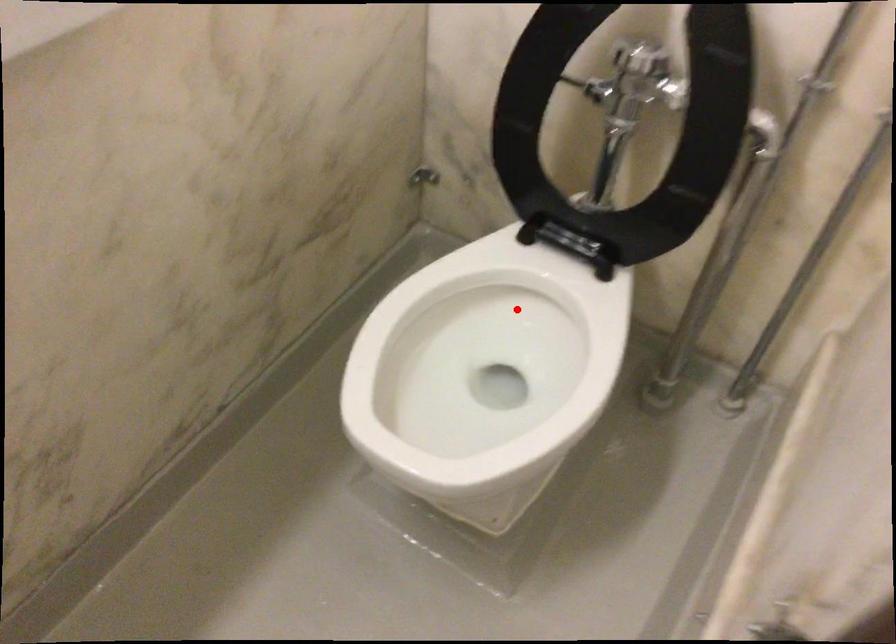
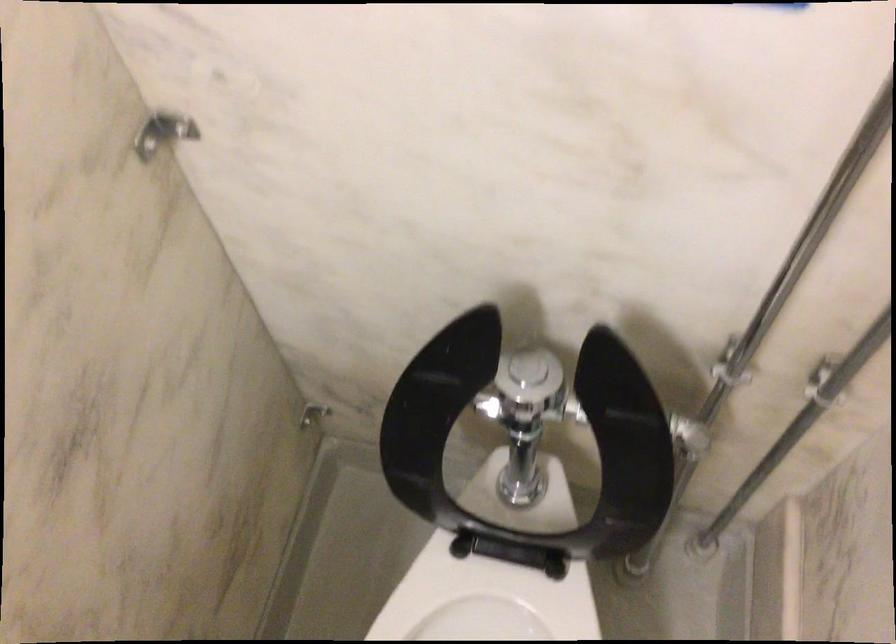
The point at the highlighted location is marked in the first image. Where is the corresponding point in the second image?

(487, 605)